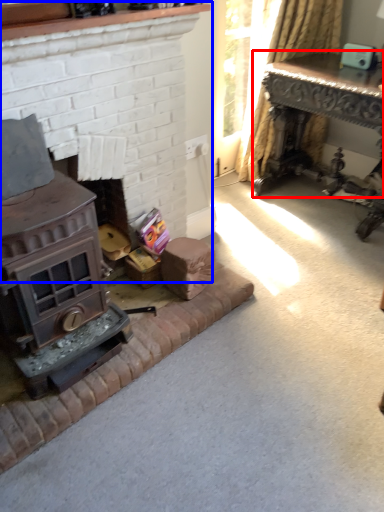
Question: Which object appears closest to the camera in this image, table (highlighted by a red box) or fireplace (highlighted by a blue box)?

Choices:
 (A) table
 (B) fireplace

Answer: (B)